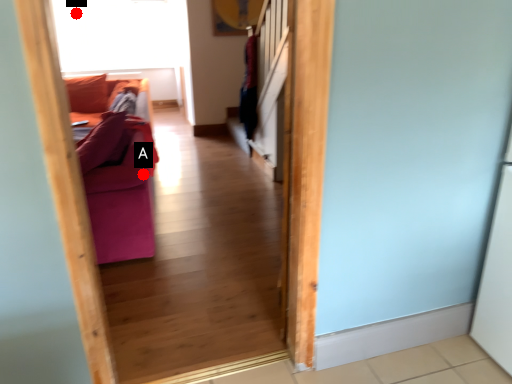
Question: Two points are circled on the image, labeled by A and B beside each circle. Which of the following is the farthest from the observer?

Choices:
 (A) A is further
 (B) B is further

Answer: (B)